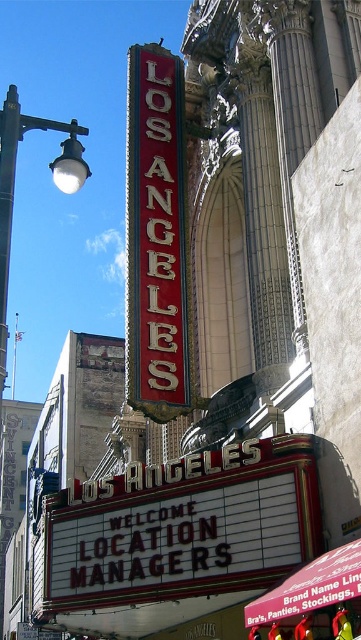
Question: Among these objects, which one is nearest to the camera?

Choices:
 (A) white metal streetlight at upper left
 (B) red enamel sign at upper center

Answer: (A)

Question: Among these points, which one is farthest from the camera?

Choices:
 (A) (144, 250)
 (B) (9, 264)

Answer: (B)

Question: From the image, what is the correct spatial relationship of red enamel sign at upper center in relation to white metal streetlight at upper left?

Choices:
 (A) above
 (B) below

Answer: (B)

Question: Can you confirm if red enamel sign at upper center is positioned to the right of white metal streetlight at upper left?

Choices:
 (A) yes
 (B) no

Answer: (A)

Question: Does red enamel sign at upper center appear under white metal streetlight at upper left?

Choices:
 (A) yes
 (B) no

Answer: (A)